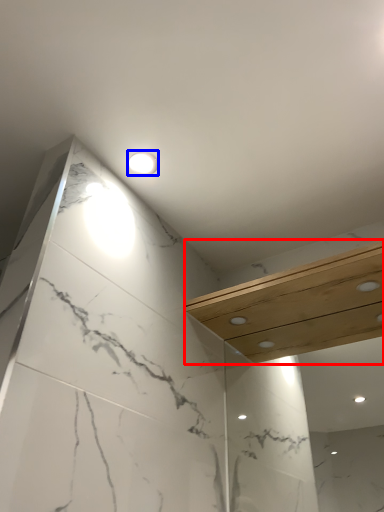
Question: Which point is further to the camera, balustrade (highlighted by a red box) or light fixture (highlighted by a blue box)?

Choices:
 (A) balustrade
 (B) light fixture

Answer: (B)